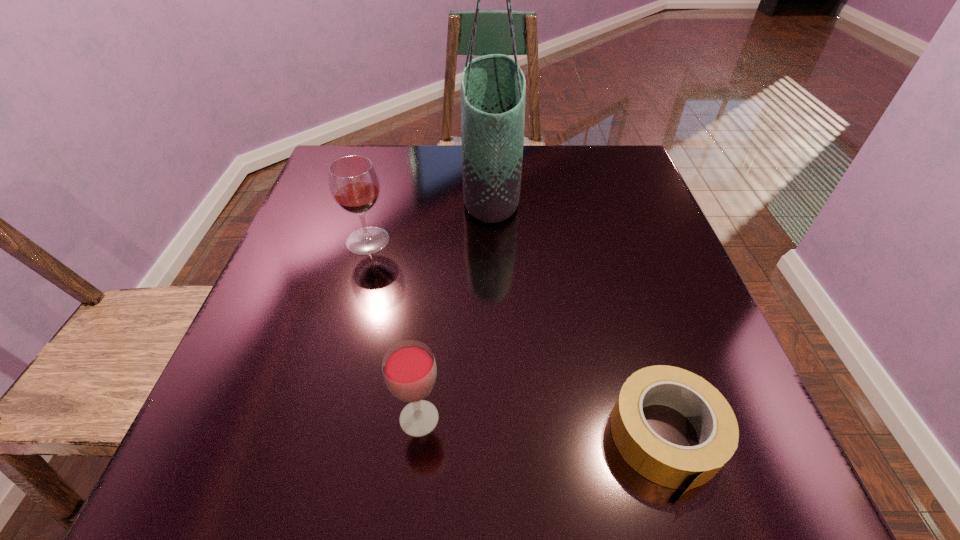
At what (x,y) coordinates should I click in order to perform the action: click on vacant space at the far right corner. Please return your answer as a coordinate pair (x, y). This screenshot has width=960, height=540. Looking at the image, I should click on (631, 170).

I want to click on free region at the near right corner, so click(x=755, y=496).

I want to click on free space between the farthest object and the nearer wineglass, so click(455, 302).

Where is `blank region between the nearer wineglass and the shortest object`? Image resolution: width=960 pixels, height=540 pixels. blank region between the nearer wineglass and the shortest object is located at coordinates (542, 428).

The image size is (960, 540). Identify the location of vacant space that is in between the second farthest object and the farthest object. (429, 213).

At what (x,y) coordinates should I click in order to perform the action: click on free space between the third tallest object and the tote bag. Please return your answer as a coordinate pair (x, y). Looking at the image, I should click on (455, 302).

You are a GUI agent. You are given a task and a screenshot of the screen. Output one action in this format:
    pyautogui.click(x=<x>, y=<y>)
    Task: Click on the vacant space in between the third object from left to right and the farther wineglass
    The height and width of the screenshot is (540, 960).
    Given the screenshot: What is the action you would take?
    pyautogui.click(x=429, y=213)

At what (x,y) coordinates should I click in order to perform the action: click on free space between the third object from left to right and the shortest object. Please return your answer as a coordinate pair (x, y). Looking at the image, I should click on tap(579, 312).

This screenshot has width=960, height=540. Identify the location of empty location between the right wineglass and the left wineglass. (394, 329).

This screenshot has width=960, height=540. Identify the location of empty space between the second shortest object and the left wineglass. (394, 329).